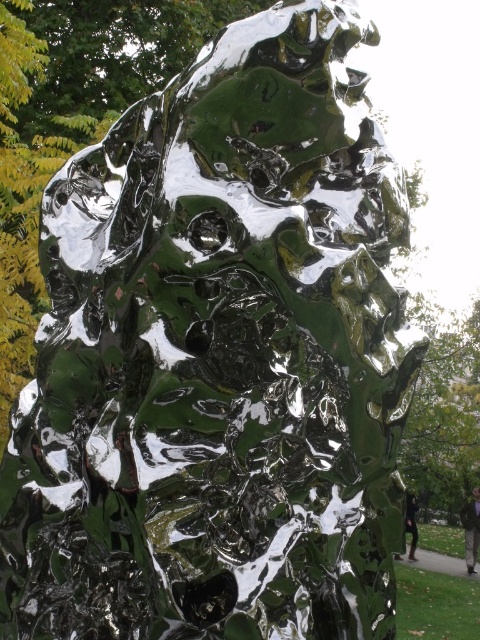
From the picture: Does glossy green sculpture at center have a greater width compared to dark green glossy statue at right?

Yes, glossy green sculpture at center is wider than dark green glossy statue at right.

Can you confirm if glossy green sculpture at center is thinner than dark green glossy statue at right?

In fact, glossy green sculpture at center might be wider than dark green glossy statue at right.

Who is more forward, (474, 547) or (415, 548)?

Positioned in front is point (474, 547).

The width and height of the screenshot is (480, 640). Find the location of `glossy green sculpture at center`. glossy green sculpture at center is located at coordinates (470, 529).